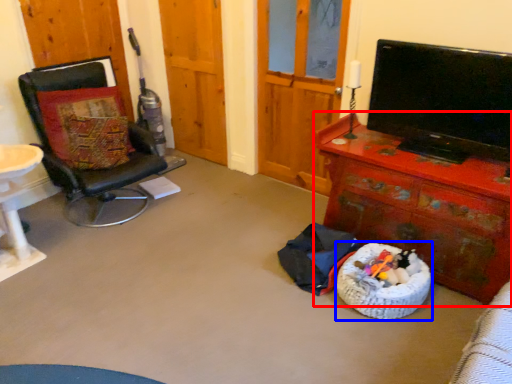
Question: Which point is closer to the camera, desk (highlighted by a red box) or dog bed (highlighted by a blue box)?

Choices:
 (A) desk
 (B) dog bed

Answer: (A)